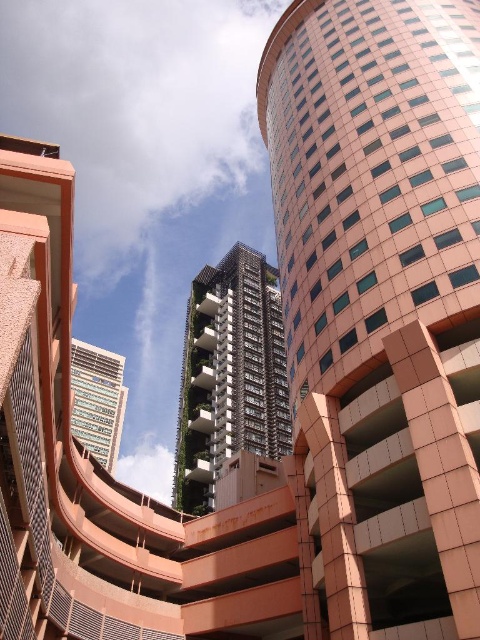
This screenshot has height=640, width=480. Describe the element at coordinates (381, 307) in the screenshot. I see `pink tile building at center` at that location.

Image resolution: width=480 pixels, height=640 pixels. Describe the element at coordinates (381, 307) in the screenshot. I see `pink tile building at center` at that location.

I want to click on pink tile building at center, so click(x=381, y=307).

Does pink tile building at center have a lesser width compared to metallic glass skyscraper at center?

Indeed, pink tile building at center has a lesser width compared to metallic glass skyscraper at center.

Is point (272, 172) behind point (106, 422)?

No, (272, 172) is closer to viewer.

You are a GUI agent. You are given a task and a screenshot of the screen. Output one action in this format:
    pyautogui.click(x=<x>, y=<y>)
    Task: Click on the pink tile building at center
    
    Given the screenshot: What is the action you would take?
    pyautogui.click(x=381, y=307)

The height and width of the screenshot is (640, 480). What do you see at coordinates (229, 374) in the screenshot?
I see `green textured building at center` at bounding box center [229, 374].

Is green textured building at center wider than metallic glass skyscraper at center?

In fact, green textured building at center might be narrower than metallic glass skyscraper at center.

Between point (255, 420) and point (124, 387), which one is positioned behind?

The point (124, 387) is behind.

Find the location of `green textured building at center`. green textured building at center is located at coordinates (229, 374).